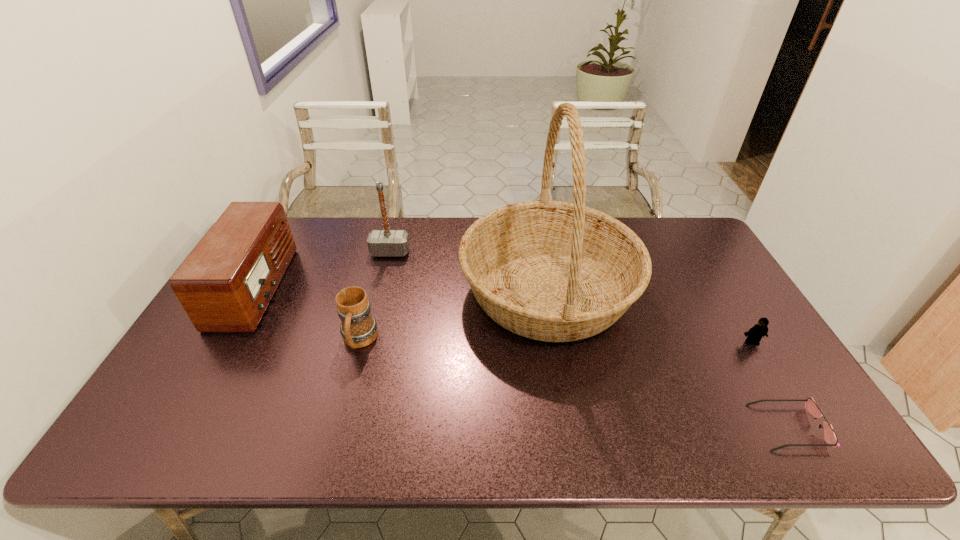
Identify which object is the second closest to the mug. Please provide its 2D coordinates. Your answer should be formatted as a tuple, i.e. [(x, y)], where the tuple contains the x and y coordinates of a point satisfying the conditions above.

[(226, 283)]

Identify which object is the fourth closest to the third shortest object. Please provide its 2D coordinates. Your answer should be formatted as a tuple, i.e. [(x, y)], where the tuple contains the x and y coordinates of a point satisfying the conditions above.

[(830, 437)]

The width and height of the screenshot is (960, 540). I want to click on vacant space that satisfies the following two spatial constraints: 1. on the front-facing side of the third tallest object; 2. on the right side of the tallest object, so click(255, 291).

Where is `vacant space that satisfies the following two spatial constraints: 1. on the striking surface of the fifth shortest object; 2. on the front-facing side of the radio receiver`? This screenshot has height=540, width=960. vacant space that satisfies the following two spatial constraints: 1. on the striking surface of the fifth shortest object; 2. on the front-facing side of the radio receiver is located at coordinates [x=381, y=287].